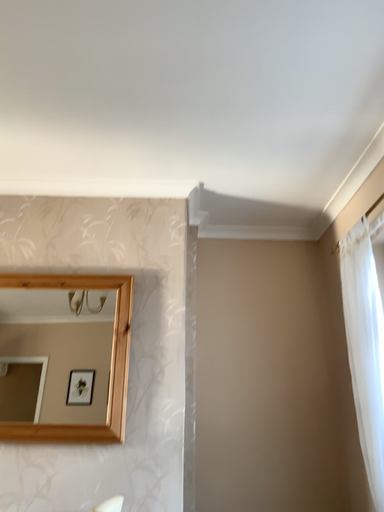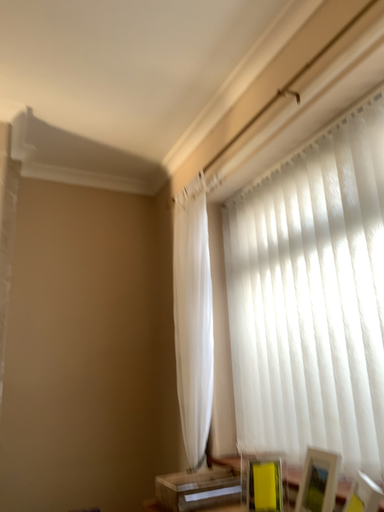
Question: Which way did the camera rotate in the video?

Choices:
 (A) rotated downward
 (B) rotated upward

Answer: (A)